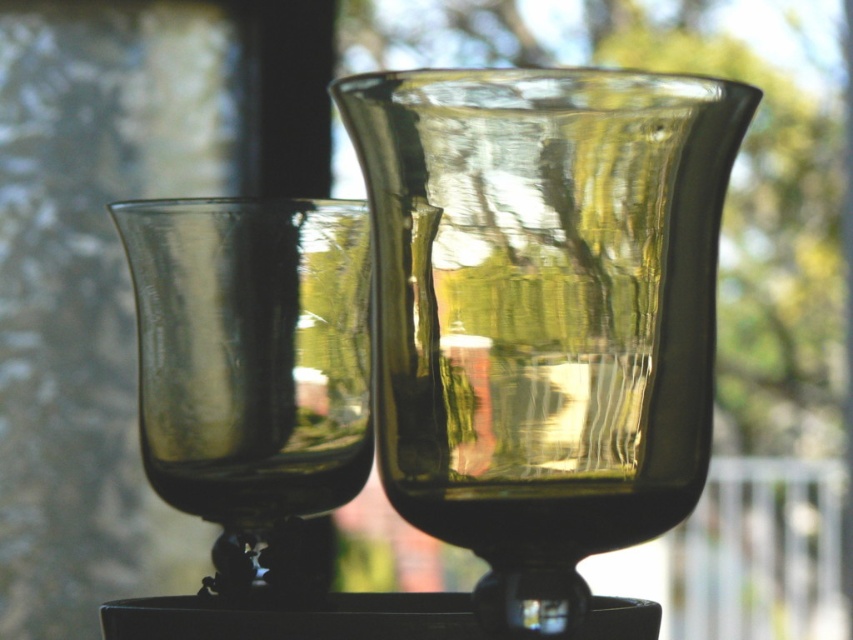
You are setting up a table for a dinner party and need to arrange two transparent glass items. You have a transparent glass vase at center and a transparent glass wine glass at center. According to the image, which one should you place to the right of the other to match the scene?

The transparent glass vase at center should be placed to the right of the transparent glass wine glass at center because the transparent glass vase at center is positioned on the right side of the transparent glass wine glass at center in the image.

You are standing in a garden and see the transparent glass vase at center. If you walk straight ahead, will you walk into it?

Yes, because the transparent glass vase at center is located directly in front of you at point coordinates, so walking straight ahead would lead you to collide with it.

You are arranging a table for a dinner party and need to place both the transparent glass vase at center and the transparent glass wine glass at center. If you want to ensure the wine glass is visible, where should you position the vase relative to the wine glass?

The transparent glass vase at center is currently in front of the transparent glass wine glass at center, so to make the wine glass visible, move the vase behind it.